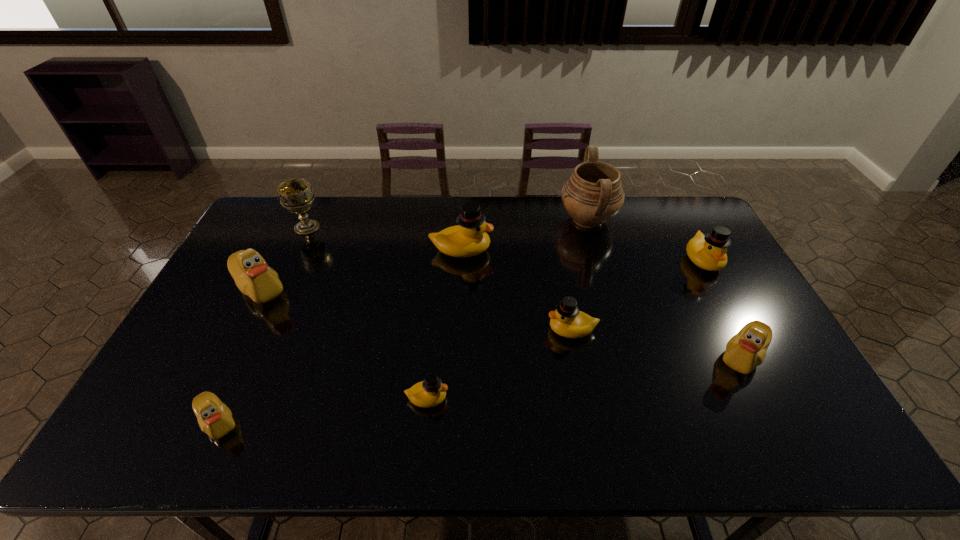
Choose which yellow duck is the second nearest neighbor to the nearest beige duck. Please provide its 2D coordinates. Your answer should be formatted as a tuple, i.e. [(x, y)], where the tuple contains the x and y coordinates of a point satisfying the conditions above.

[(469, 238)]

Identify which beige duck is located as the nearest to the smallest yellow duck. Please provide its 2D coordinates. Your answer should be formatted as a tuple, i.e. [(x, y)], where the tuple contains the x and y coordinates of a point satisfying the conditions above.

[(215, 419)]

Where is `the third closest beige duck relative to the urn`? The image size is (960, 540). the third closest beige duck relative to the urn is located at coordinates (215, 419).

You are a GUI agent. You are given a task and a screenshot of the screen. Output one action in this format:
    pyautogui.click(x=<x>, y=<y>)
    Task: Click on the free location that satisfies the following two spatial constraints: 1. on the front-facing side of the nearest yellow duck; 2. at the beak of the smallest beige duck
    The image size is (960, 540).
    Given the screenshot: What is the action you would take?
    pyautogui.click(x=424, y=422)